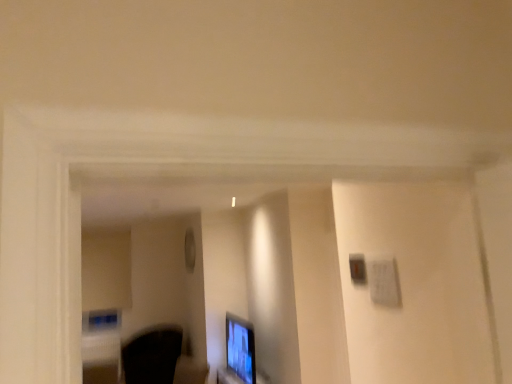
Question: From the image's perspective, would you say black fabric swivel chair at lower left is shown under matte black monitor at lower center?

Choices:
 (A) no
 (B) yes

Answer: (B)

Question: Can we say black fabric swivel chair at lower left lies outside matte black monitor at lower center?

Choices:
 (A) yes
 (B) no

Answer: (A)

Question: From a real-world perspective, is black fabric swivel chair at lower left over matte black monitor at lower center?

Choices:
 (A) no
 (B) yes

Answer: (A)

Question: Is matte black monitor at lower center completely or partially inside black fabric swivel chair at lower left?

Choices:
 (A) yes
 (B) no

Answer: (B)

Question: Does black fabric swivel chair at lower left have a greater width compared to matte black monitor at lower center?

Choices:
 (A) no
 (B) yes

Answer: (B)

Question: Is black fabric swivel chair at lower left beside matte black monitor at lower center?

Choices:
 (A) yes
 (B) no

Answer: (B)

Question: Can you confirm if matte black monitor at lower center is shorter than black fabric swivel chair at lower left?

Choices:
 (A) yes
 (B) no

Answer: (B)

Question: From the image's perspective, does matte black monitor at lower center appear higher than black fabric swivel chair at lower left?

Choices:
 (A) no
 (B) yes

Answer: (B)

Question: Considering the relative sizes of matte black monitor at lower center and black fabric swivel chair at lower left in the image provided, is matte black monitor at lower center bigger than black fabric swivel chair at lower left?

Choices:
 (A) no
 (B) yes

Answer: (A)

Question: Considering the relative sizes of matte black monitor at lower center and black fabric swivel chair at lower left in the image provided, is matte black monitor at lower center thinner than black fabric swivel chair at lower left?

Choices:
 (A) yes
 (B) no

Answer: (A)

Question: From a real-world perspective, is matte black monitor at lower center over black fabric swivel chair at lower left?

Choices:
 (A) yes
 (B) no

Answer: (A)

Question: Is the position of matte black monitor at lower center less distant than that of black fabric swivel chair at lower left?

Choices:
 (A) no
 (B) yes

Answer: (B)

Question: In terms of width, does matte black monitor at lower center look wider or thinner when compared to black fabric swivel chair at lower left?

Choices:
 (A) thin
 (B) wide

Answer: (A)